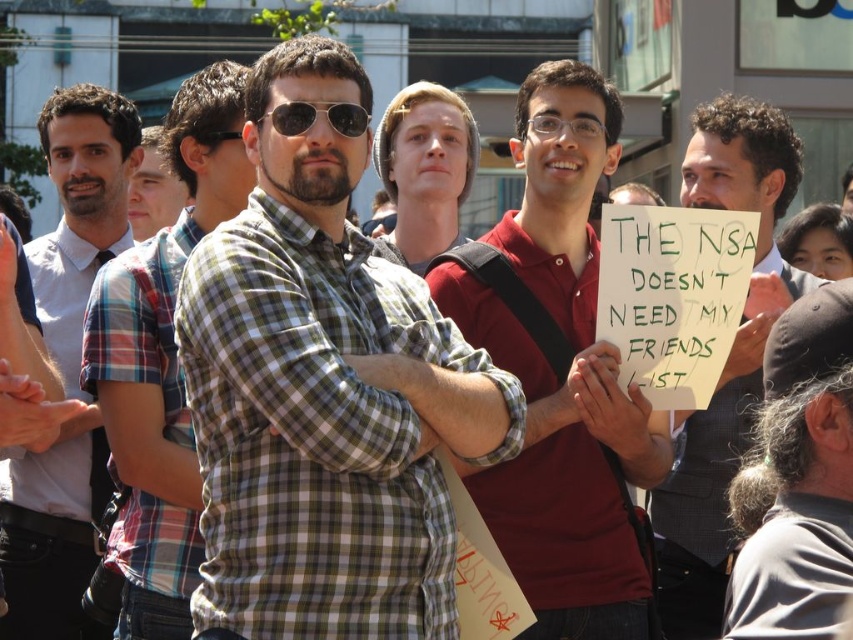
Question: Does gray hair at lower right come behind metallic reflective sunglasses at center?

Choices:
 (A) no
 (B) yes

Answer: (A)

Question: Which point is farther to the camera?

Choices:
 (A) (572, 257)
 (B) (165, 205)
 (C) (463, 141)
 (D) (450, 378)

Answer: (B)

Question: Does green plaid shirt at center appear on the right side of gray hair at lower right?

Choices:
 (A) no
 (B) yes

Answer: (A)

Question: Which object is the closest to the matte red polo shirt at center?

Choices:
 (A) metallic reflective sunglasses at center
 (B) gray hair at lower right
 (C) green plaid shirt at center

Answer: (C)

Question: Which is farther from the plaid shirt at center?

Choices:
 (A) light blue plaid shirt at center
 (B) light brown knit hat at center

Answer: (B)

Question: Does matte red polo shirt at center appear under light blue plaid shirt at center?

Choices:
 (A) no
 (B) yes

Answer: (A)